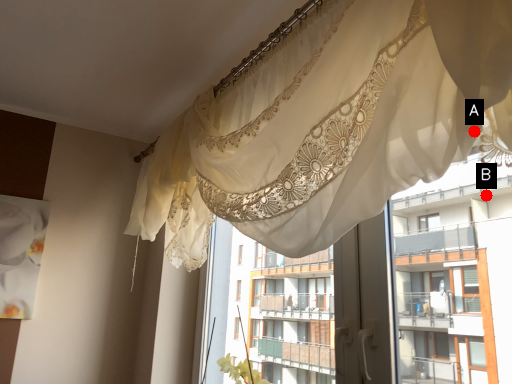
Question: Two points are circled on the image, labeled by A and B beside each circle. Which point is closer to the camera taking this photo?

Choices:
 (A) A is closer
 (B) B is closer

Answer: (A)